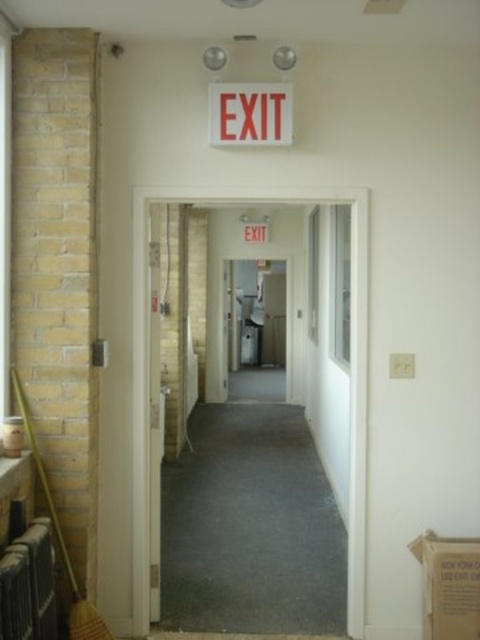
You are moving a cardboard box at lower right and need to pass under the red plastic exit sign at upper center. Can you safely lift the box without hitting the sign?

The cardboard box at lower right is bigger than the red plastic exit sign at upper center, so lifting it might risk hitting the sign. Check the clearance before lifting to ensure safety.